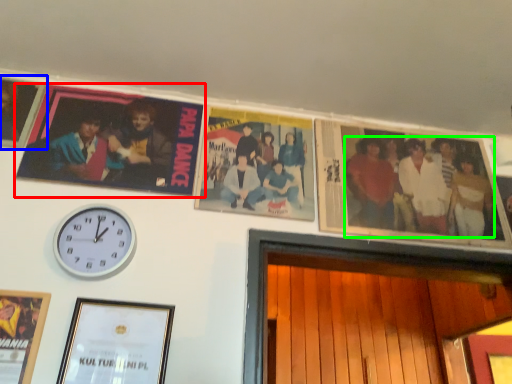
Question: Based on their relative distances, which object is nearer to picture frame (highlighted by a red box)? Choose from picture frame (highlighted by a blue box) and person (highlighted by a green box).

Choices:
 (A) picture frame
 (B) person

Answer: (A)